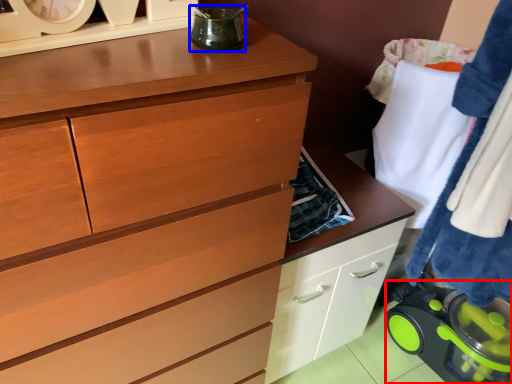
Question: Among these objects, which one is farthest to the camera, appliance (highlighted by a red box) or appliance (highlighted by a blue box)?

Choices:
 (A) appliance
 (B) appliance

Answer: (A)